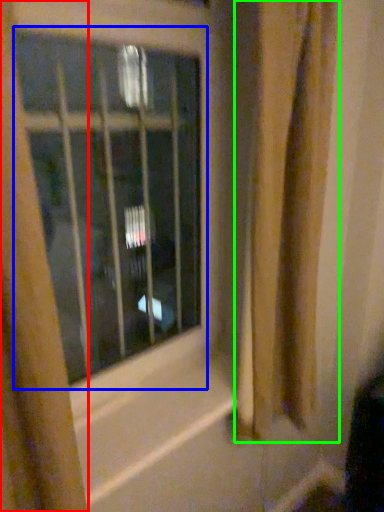
Question: Considering the real-world distances, which object is farthest from curtain (highlighted by a red box)? window (highlighted by a blue box) or shower curtain (highlighted by a green box)?

Choices:
 (A) window
 (B) shower curtain

Answer: (A)